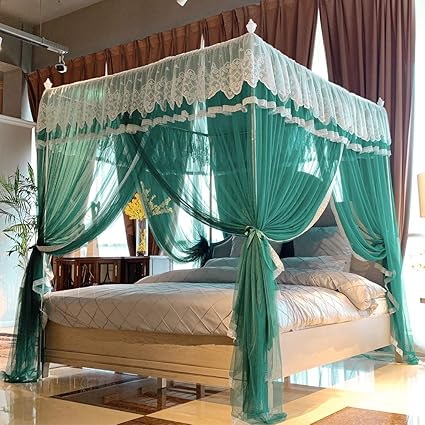
Find the location of a particular element. white curtain is located at coordinates (227, 75).